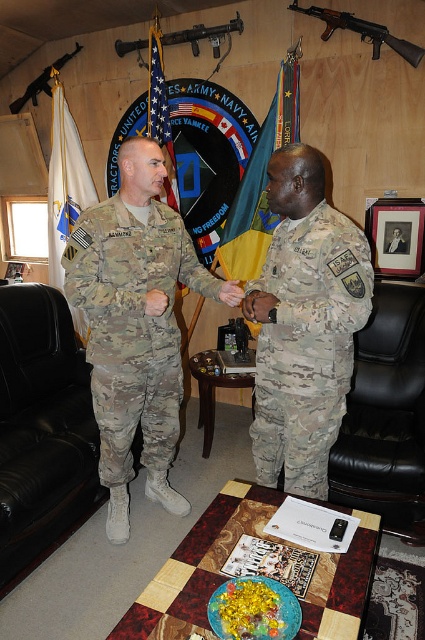
You are an observer in the room. You see the camouflage fabric uniform at left and the matte black rifle at upper center. Which object is closer to the right side of the room?

The camouflage fabric uniform at left is positioned on the right side of the matte black rifle at upper center, so it is closer to the right side of the room.